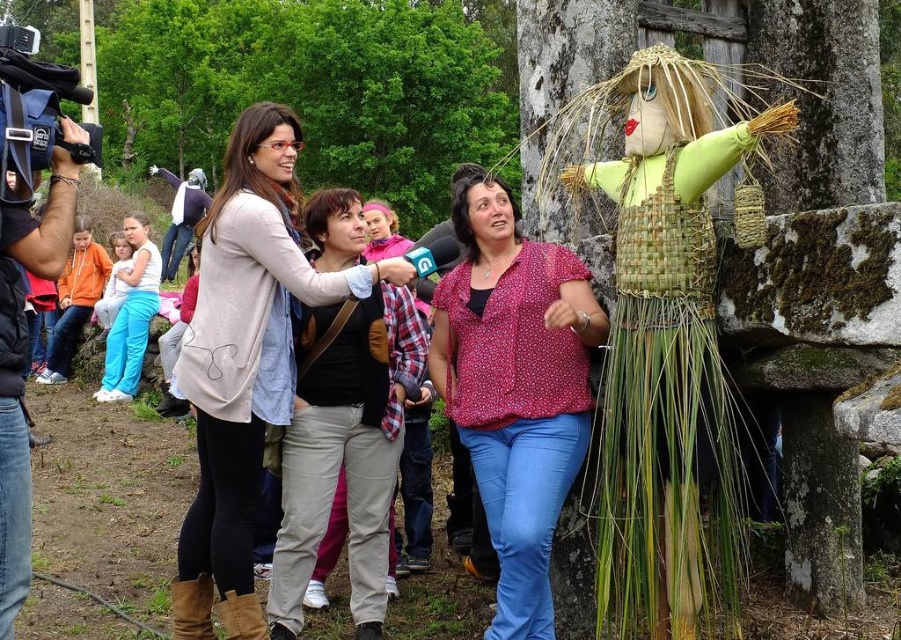
Question: Can you confirm if matte beige sweater at center is bigger than floral blouse at center?

Choices:
 (A) no
 (B) yes

Answer: (A)

Question: Which point is closer to the camera taking this photo?

Choices:
 (A) coord(576,323)
 (B) coord(240,579)

Answer: (A)

Question: Which point is closer to the camera?

Choices:
 (A) matte beige sweater at center
 (B) floral blouse at center

Answer: (B)

Question: Is matte beige sweater at center positioned in front of floral blouse at center?

Choices:
 (A) no
 (B) yes

Answer: (A)

Question: Is matte beige sweater at center bigger than floral blouse at center?

Choices:
 (A) yes
 (B) no

Answer: (B)